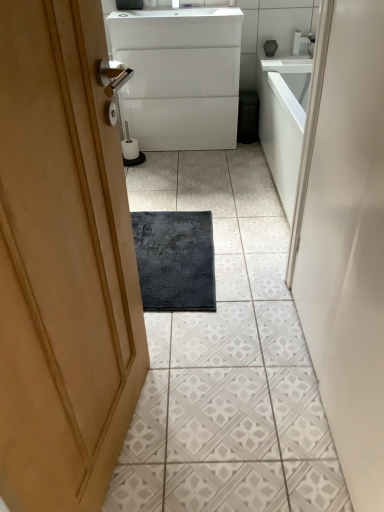
This screenshot has width=384, height=512. Describe the element at coordinates (175, 4) in the screenshot. I see `white glossy faucet at upper center` at that location.

Find the location of a particular element. Image resolution: width=384 pixels, height=512 pixels. white glossy cabinet at center is located at coordinates (180, 76).

Locate an element on the screen. This screenshot has height=512, width=384. polished brass door handle at upper center is located at coordinates (114, 76).

Find the location of a particular element. The height and width of the screenshot is (512, 384). white glossy countertop at upper center is located at coordinates (288, 64).

Which is behind, white glossy countertop at upper center or white glossy tap at upper center?

white glossy tap at upper center is behind.

Can you tell me how much white glossy countertop at upper center and white glossy tap at upper center differ in facing direction?

0.83 degrees separate the facing orientations of white glossy countertop at upper center and white glossy tap at upper center.

Is white glossy countertop at upper center to the right of white glossy tap at upper center from the viewer's perspective?

In fact, white glossy countertop at upper center is to the left of white glossy tap at upper center.

Consider the image. How far apart are white glossy countertop at upper center and white glossy tap at upper center?

white glossy countertop at upper center and white glossy tap at upper center are 6.95 inches apart from each other.

Consider the image. Considering the relative sizes of white textured tile at center and white glossy faucet at upper center in the image provided, is white textured tile at center thinner than white glossy faucet at upper center?

Incorrect, the width of white textured tile at center is not less than that of white glossy faucet at upper center.

From a real-world perspective, between white textured tile at center and white glossy faucet at upper center, who is vertically higher?

white glossy faucet at upper center.

Is white textured tile at center far from white glossy faucet at upper center?

Yes, white textured tile at center and white glossy faucet at upper center are located far from each other.

Is white glossy cabinet at center far from polished brass door handle at upper center?

white glossy cabinet at center is far away from polished brass door handle at upper center.

Is white glossy cabinet at center positioned beyond the bounds of polished brass door handle at upper center?

Absolutely, white glossy cabinet at center is external to polished brass door handle at upper center.

In the scene shown: From the image's perspective, which object appears higher, white glossy cabinet at center or polished brass door handle at upper center?

From the image's view, white glossy cabinet at center is above.

Does white glossy cabinet at center have a smaller size compared to polished brass door handle at upper center?

No, white glossy cabinet at center is not smaller than polished brass door handle at upper center.

Which object is positioned more to the right, polished brass door handle at upper center or white textured tile at center?

white textured tile at center is more to the right.

Choose the correct answer: Is polished brass door handle at upper center inside white textured tile at center or outside it?

polished brass door handle at upper center is outside white textured tile at center.

Considering the sizes of objects polished brass door handle at upper center and white textured tile at center in the image provided, who is shorter, polished brass door handle at upper center or white textured tile at center?

With less height is white textured tile at center.

From the image's perspective, which one is positioned lower, white glossy countertop at upper center or polished brass door handle at upper center?

From the image's view, polished brass door handle at upper center is below.

Which of these two, white glossy countertop at upper center or polished brass door handle at upper center, is wider?

white glossy countertop at upper center.

Visually, is white glossy countertop at upper center positioned to the left or to the right of polished brass door handle at upper center?

white glossy countertop at upper center is positioned on polished brass door handle at upper center's right side.

From a real-world perspective, which object stands above the other?

In real-world perspective, white glossy countertop at upper center is above.

The image size is (384, 512). Identify the location of door handle located below the white glossy cabinet at center (from the image's perspective). pyautogui.click(x=114, y=76).

Does polished brass door handle at upper center turn towards white glossy cabinet at center?

No, polished brass door handle at upper center is not turned towards white glossy cabinet at center.

Is polished brass door handle at upper center inside or outside of white glossy cabinet at center?

polished brass door handle at upper center is not enclosed by white glossy cabinet at center.

Considering the positions of points (115, 61) and (213, 22), is point (115, 61) closer to camera compared to point (213, 22)?

No.

Is white glossy tap at upper center with white glossy countertop at upper center?

No.

From a real-world perspective, which object stands above the other?

white glossy tap at upper center.

Is white glossy tap at upper center completely or partially outside of white glossy countertop at upper center?

Yes, white glossy tap at upper center is located beyond the bounds of white glossy countertop at upper center.

I want to click on counter top that appears on the left of white glossy tap at upper center, so click(288, 64).

I want to click on faucet behind the white textured tile at center, so click(175, 4).

Estimate the real-world distances between objects in this image. Which object is closer to white glossy faucet at upper center, polished brass door handle at upper center or white textured tile at center?

polished brass door handle at upper center is positioned closer to the anchor white glossy faucet at upper center.

From the image, which object appears to be farther from white glossy tap at upper center, white glossy faucet at upper center or white glossy countertop at upper center?

Among the two, white glossy faucet at upper center is located further to white glossy tap at upper center.

Based on the photo, when comparing their distances from white glossy cabinet at center, does white glossy countertop at upper center or white textured tile at center seem further?

white textured tile at center lies further to white glossy cabinet at center than the other object.

Considering their positions, is white glossy tap at upper center positioned closer to white glossy faucet at upper center than white textured tile at center?

Based on the image, white glossy tap at upper center appears to be nearer to white glossy faucet at upper center.

When comparing their distances from white glossy cabinet at center, does white glossy tap at upper center or white textured tile at center seem closer?

white glossy tap at upper center is closer to white glossy cabinet at center.

Based on their spatial positions, is white textured tile at center or white glossy cabinet at center closer to white glossy tap at upper center?

white glossy cabinet at center is closer to white glossy tap at upper center.

From the image, which object appears to be farther from polished brass door handle at upper center, white textured tile at center or white glossy tap at upper center?

The object further to polished brass door handle at upper center is white glossy tap at upper center.

Which object lies nearer to the anchor point polished brass door handle at upper center, white glossy tap at upper center or white textured tile at center?

The object closer to polished brass door handle at upper center is white textured tile at center.

The image size is (384, 512). I want to click on counter top between white textured tile at center and white glossy tap at upper center along the z-axis, so click(x=288, y=64).

The height and width of the screenshot is (512, 384). What are the coordinates of `counter top between white glossy faucet at upper center and white glossy tap at upper center from left to right` in the screenshot? It's located at (288, 64).

Image resolution: width=384 pixels, height=512 pixels. I want to click on bathroom cabinet situated between polished brass door handle at upper center and white glossy countertop at upper center from left to right, so click(x=180, y=76).

Where is `bathroom cabinet positioned between white textured tile at center and white glossy faucet at upper center from near to far`? Image resolution: width=384 pixels, height=512 pixels. bathroom cabinet positioned between white textured tile at center and white glossy faucet at upper center from near to far is located at coordinates (180, 76).